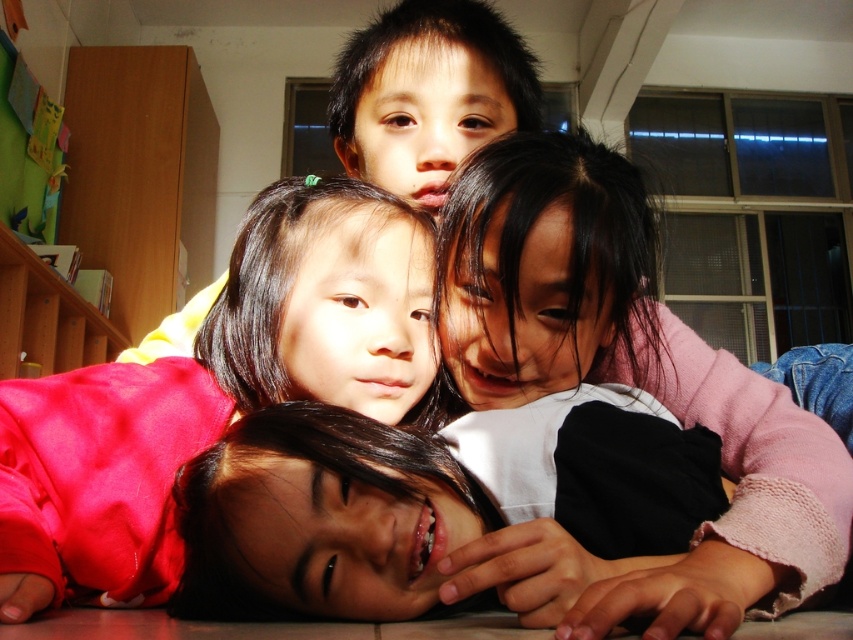
Based on the photo, you are an interior designer analyzing the layout of this indoor scene. You notice the smooth pink sweater at center. Can you determine its exact 2D coordinates in the image?

The smooth pink sweater at center is located at the 2D coordinates of point (213, 387).

You are an artist trying to sketch the scene. You need to place the smooth skin child at center at a specific coordinate. What are the coordinates where you should position this child?

The smooth skin child at center should be positioned at the coordinates point (581, 342).

Based on the scene description, can you determine which object is taller between the smooth skin child at center and the smooth pink sweater at center?

The smooth skin child at center is much taller than the smooth pink sweater at center.